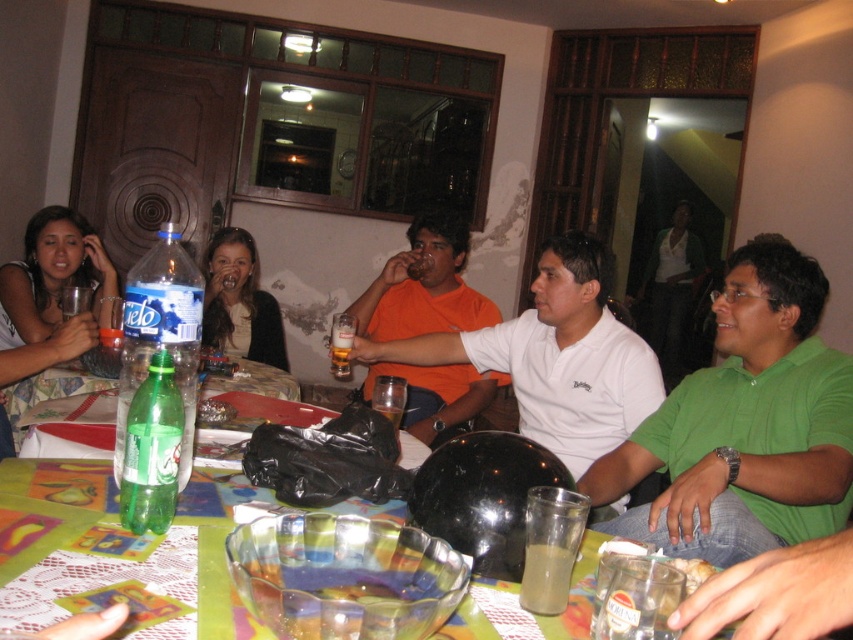
The height and width of the screenshot is (640, 853). Describe the element at coordinates (424, 285) in the screenshot. I see `orange matte shirt at center` at that location.

You are a GUI agent. You are given a task and a screenshot of the screen. Output one action in this format:
    pyautogui.click(x=<x>, y=<y>)
    Task: Click on the orange matte shirt at center
    The width and height of the screenshot is (853, 640).
    Given the screenshot: What is the action you would take?
    pyautogui.click(x=424, y=285)

Can you confirm if white cotton shirt at center is positioned to the left of green plastic bottle at lower left?

Incorrect, white cotton shirt at center is not on the left side of green plastic bottle at lower left.

Does white cotton shirt at center appear on the right side of green plastic bottle at lower left?

Correct, you'll find white cotton shirt at center to the right of green plastic bottle at lower left.

Is point (531, 384) more distant than point (196, 339)?

Yes, it is.

Identify the location of white cotton shirt at center. Image resolution: width=853 pixels, height=640 pixels. (555, 356).

Can you confirm if matte black hair at left is positioned above green plastic bottle at lower left?

Actually, matte black hair at left is below green plastic bottle at lower left.

Between point (28, 362) and point (126, 436), which one is positioned behind?

The point (28, 362) is behind.

This screenshot has height=640, width=853. I want to click on matte black hair at left, so click(49, 285).